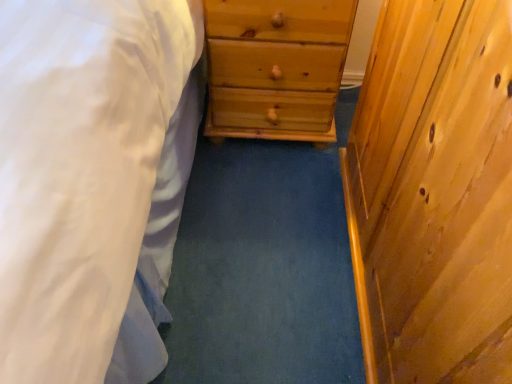
Where is `free location in front of light brown wooden chest of drawers at center`? The width and height of the screenshot is (512, 384). free location in front of light brown wooden chest of drawers at center is located at coordinates (269, 190).